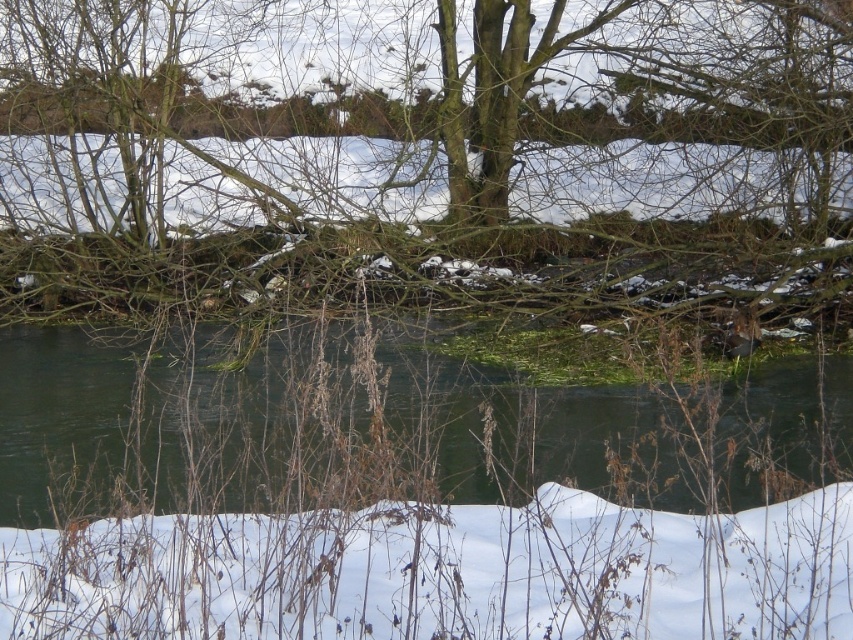
You are a hiker who wants to cross the stream shown in the image. You notice the green algae at center and the white fluffy snow at lower center. Which object should you avoid stepping on to prevent slipping?

You should avoid stepping on the green algae at center because it is positioned on the right side of the white fluffy snow at lower center, making it more slippery than the snow.